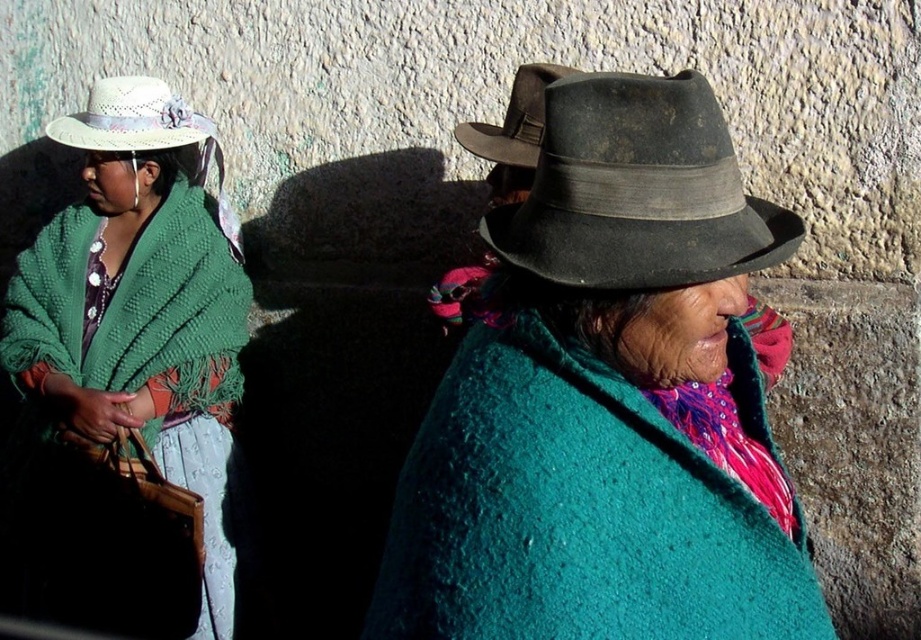
Question: Does teal woolen shawl at center have a smaller size compared to dark brown felt cowboy hat at upper right?

Choices:
 (A) yes
 (B) no

Answer: (B)

Question: Observing the image, what is the correct spatial positioning of teal woolen shawl at center in reference to matte green shawl at left?

Choices:
 (A) right
 (B) left

Answer: (A)

Question: Considering the real-world distances, which object is closest to the matte green shawl at left?

Choices:
 (A) dark gray felt fedora at center
 (B) dark brown felt cowboy hat at upper right
 (C) white straw hat at upper left

Answer: (C)

Question: Which point is closer to the camera?

Choices:
 (A) (157, 90)
 (B) (177, 99)
 (C) (796, 236)
 (D) (618, 204)

Answer: (D)

Question: Which of these objects is positioned closest to the white straw hat at upper left?

Choices:
 (A) dark gray felt fedora at center
 (B) teal woolen shawl at center

Answer: (A)

Question: Does matte green shawl at left appear under dark brown felt cowboy hat at upper right?

Choices:
 (A) no
 (B) yes

Answer: (B)